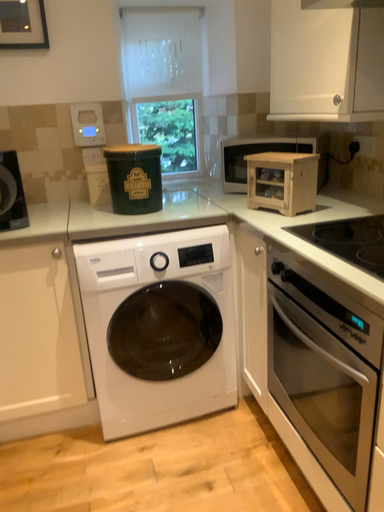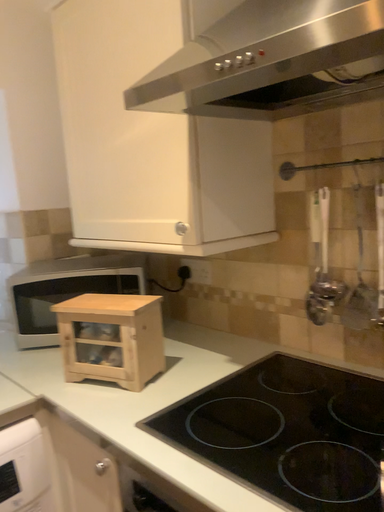
Question: How did the camera likely rotate when shooting the video?

Choices:
 (A) rotated left
 (B) rotated right

Answer: (B)